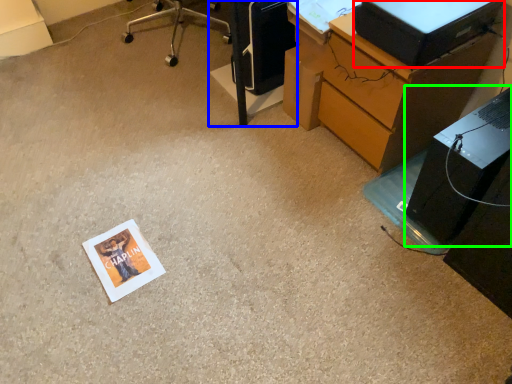
Question: Based on their relative distances, which object is farther from desktop computer (highlighted by a red box)? Choose from furniture (highlighted by a blue box) and computer tower (highlighted by a green box).

Choices:
 (A) furniture
 (B) computer tower

Answer: (A)